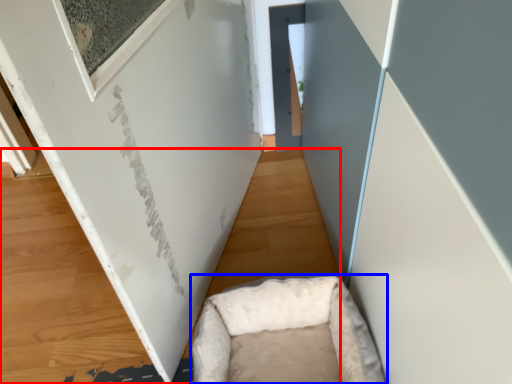
Question: Which of the following is the closest to the observer, plywood (highlighted by a red box) or furniture (highlighted by a blue box)?

Choices:
 (A) plywood
 (B) furniture

Answer: (B)